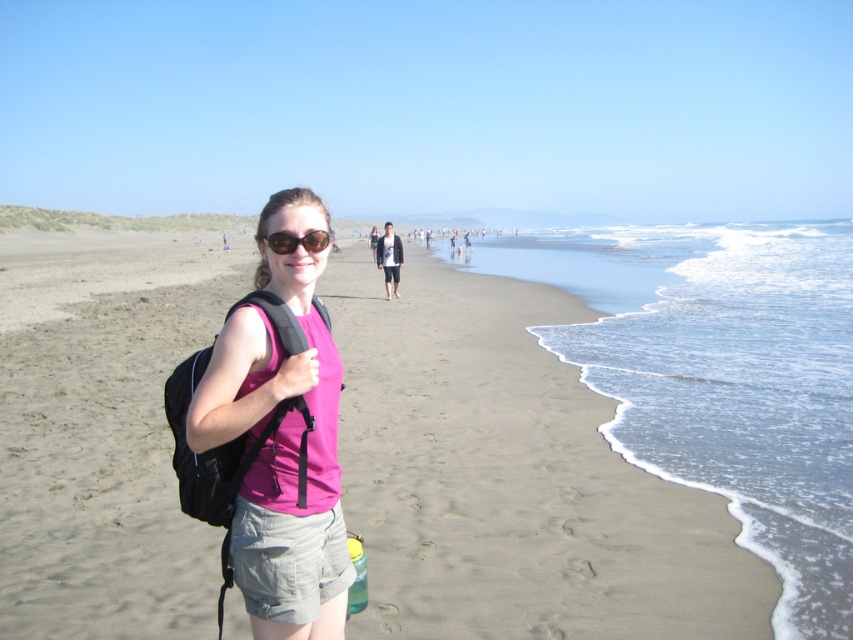
Does light brown sand at center have a smaller size compared to pink fabric shirt at center?

Actually, light brown sand at center might be larger than pink fabric shirt at center.

Between light brown sand at center and pink fabric shirt at center, which one is positioned higher?

light brown sand at center

Between point (91, 592) and point (315, 406), which one is positioned behind?

Point (91, 592)

I want to click on light brown sand at center, so click(x=509, y=476).

Locate an element on the screen. The height and width of the screenshot is (640, 853). light brown sand at center is located at coordinates click(509, 476).

Who is higher up, light brown sand at center or denim jacket at center?

Positioned higher is denim jacket at center.

This screenshot has height=640, width=853. Describe the element at coordinates (509, 476) in the screenshot. I see `light brown sand at center` at that location.

This screenshot has height=640, width=853. I want to click on light brown sand at center, so click(509, 476).

Is pink fabric shirt at center thinner than sunglasses at center?

In fact, pink fabric shirt at center might be wider than sunglasses at center.

Can you confirm if pink fabric shirt at center is positioned below sunglasses at center?

Correct, pink fabric shirt at center is located below sunglasses at center.

Does point (334, 380) lie behind point (309, 237)?

Yes, it is behind point (309, 237).

The image size is (853, 640). What are the coordinates of `pink fabric shirt at center` in the screenshot? It's located at (281, 440).